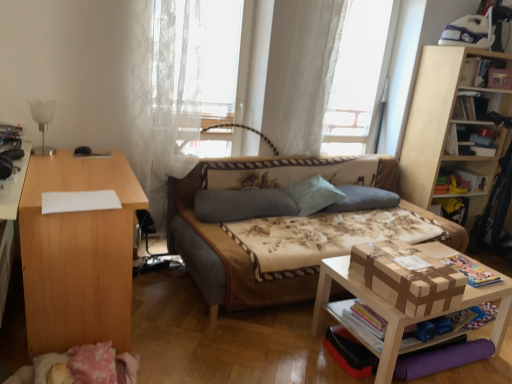
Locate an element on the screen. Image resolution: width=512 pixels, height=384 pixels. empty space that is ontop of light wood desk at left, positioned as the first table in left-to-right order (from a real-world perspective) is located at coordinates (79, 173).